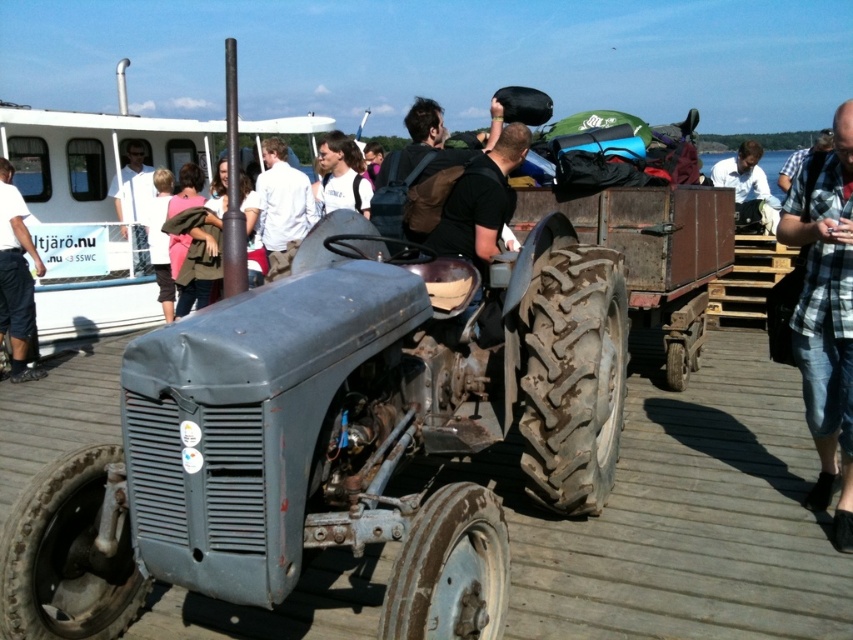
The width and height of the screenshot is (853, 640). What do you see at coordinates (747, 186) in the screenshot? I see `light blue shirt at center` at bounding box center [747, 186].

Can you confirm if light blue shirt at center is taller than light gray backpack at center?

Yes, light blue shirt at center is taller than light gray backpack at center.

This screenshot has height=640, width=853. Find the location of `light blue shirt at center`. light blue shirt at center is located at coordinates (747, 186).

Between dark brown backpack at center and light gray backpack at center, which one is positioned lower?

Positioned lower is dark brown backpack at center.

Is point (489, 154) positioned before point (341, 164)?

That is True.

Find the location of `dark brown backpack at center`. dark brown backpack at center is located at coordinates (480, 202).

Who is lower down, dark brown backpack at center or dark blue jeans at left?

dark blue jeans at left is below.

Who is more distant from viewer, (474, 253) or (6, 288)?

Point (6, 288)

The image size is (853, 640). I want to click on dark brown backpack at center, so click(x=480, y=202).